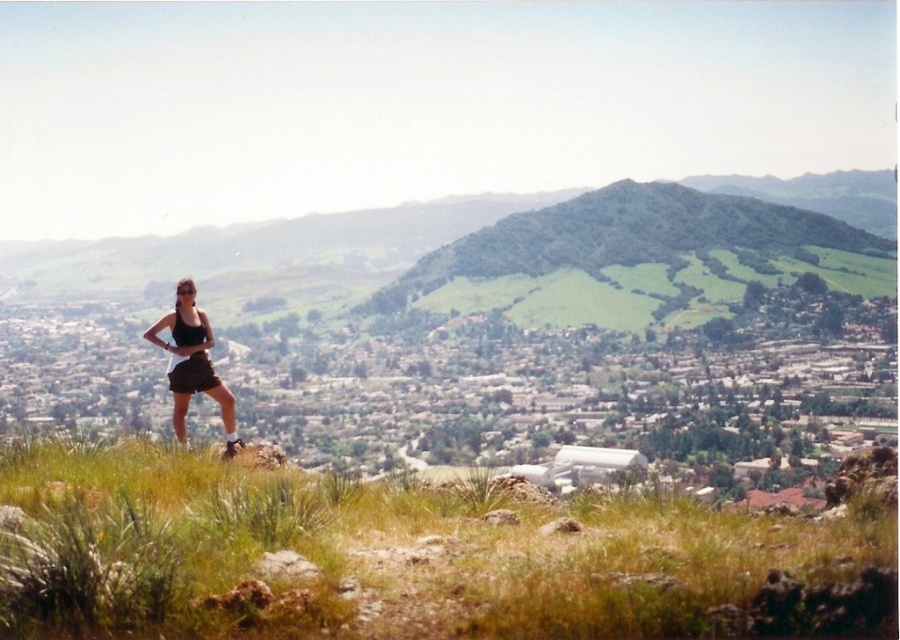
Is green grassy at left below matte black tank top at center?

Indeed, green grassy at left is positioned under matte black tank top at center.

Which is behind, point (106, 609) or point (221, 400)?

The point (221, 400) is more distant.

Identify the location of green grassy at left. (414, 556).

Can you confirm if green grassy at left is wider than black matte shorts at center?

Yes, green grassy at left is wider than black matte shorts at center.

Does point (693, 550) come behind point (207, 358)?

No.

Is point (887, 616) positioned after point (182, 371)?

No, it is in front of (182, 371).

Locate an element on the screen. This screenshot has height=640, width=900. green grassy at left is located at coordinates (414, 556).

Between point (212, 369) and point (191, 356), which one is positioned behind?

Positioned behind is point (191, 356).

Which of these two, matte black tank top at center or black matte shorts at center, stands shorter?

black matte shorts at center is shorter.

Describe the element at coordinates (192, 364) in the screenshot. This screenshot has width=900, height=640. I see `matte black tank top at center` at that location.

At what (x,y) coordinates should I click in order to perform the action: click on matte black tank top at center. Please return your answer as a coordinate pair (x, y). Looking at the image, I should click on (192, 364).